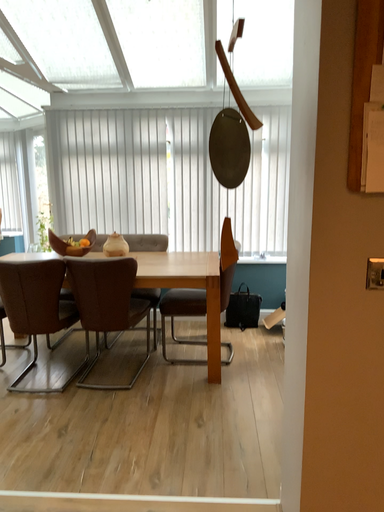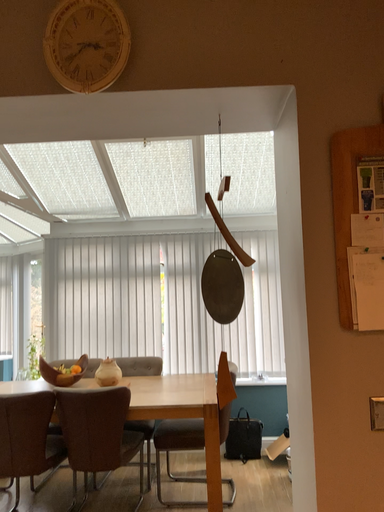
Question: How did the camera likely rotate when shooting the video?

Choices:
 (A) rotated downward
 (B) rotated upward

Answer: (B)